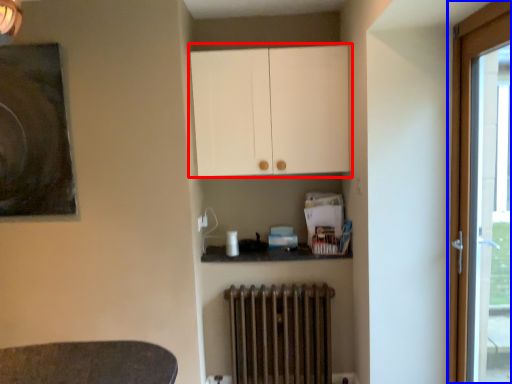
Question: Which object is further to the camera taking this photo, cabinetry (highlighted by a red box) or door (highlighted by a blue box)?

Choices:
 (A) cabinetry
 (B) door

Answer: (A)